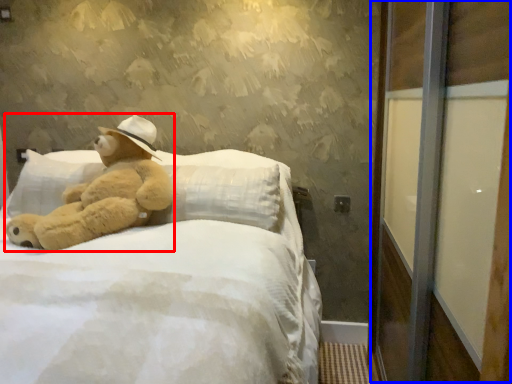
Question: Which of the following is the farthest to the observer, teddy bear (highlighted by a red box) or screen door (highlighted by a blue box)?

Choices:
 (A) teddy bear
 (B) screen door

Answer: (A)